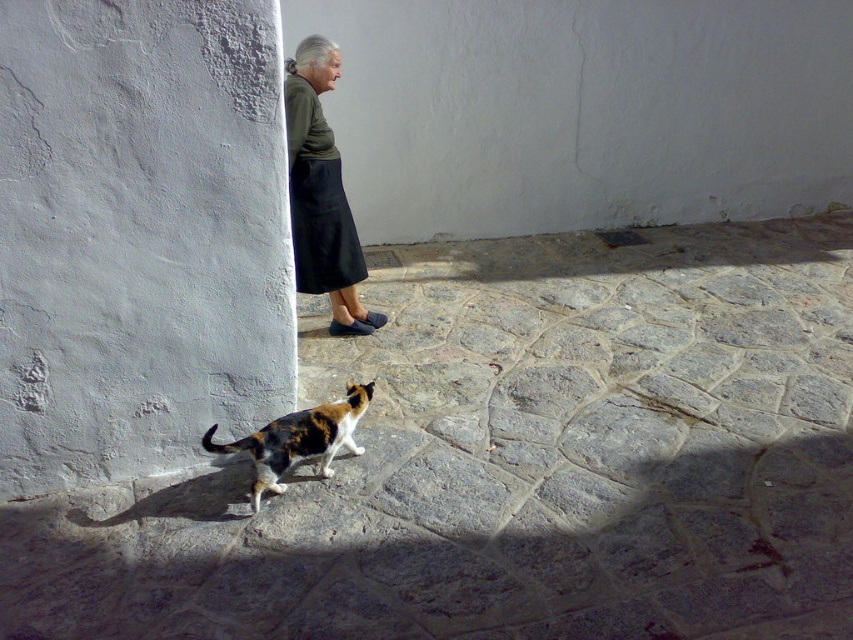
You are standing at the center of the image and want to walk towards the calico cat at lower center. According to the coordinates given, in which direction should you move?

The calico cat at lower center is located at coordinates point (514,461). Since you are at the center, you should move towards the lower right direction to reach it.

You are a photographer trying to capture a photo of the calico fur cat at lower center. There is a dark green fabric skirt at upper center in the way. Can you move the skirt to the right to get a clear shot of the cat?

The dark green fabric skirt at upper center is positioned on the left side of the calico fur cat at lower center. To get a clear shot, you can move the skirt to the right, away from the cat.